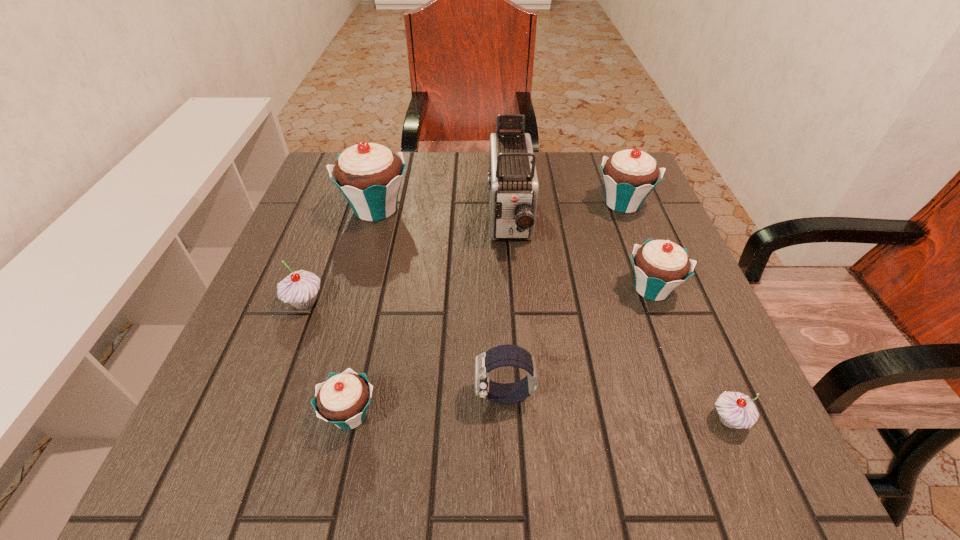
Select which object appears as the third closest to the left gray cupcake. Please provide its 2D coordinates. Your answer should be formatted as a tuple, i.e. [(x, y)], where the tuple contains the x and y coordinates of a point satisfying the conditions above.

[(503, 355)]

Select which cupcake appears as the second closest to the dark watch. Please provide its 2D coordinates. Your answer should be formatted as a tuple, i.e. [(x, y)], where the tuple contains the x and y coordinates of a point satisfying the conditions above.

[(660, 266)]

Locate which cupcake ranks fifth in proximity to the smallest teal cupcake. Please provide its 2D coordinates. Your answer should be formatted as a tuple, i.e. [(x, y)], where the tuple contains the x and y coordinates of a point satisfying the conditions above.

[(629, 176)]

Identify which teal cupcake is located as the fourth nearest to the bigger gray cupcake. Please provide its 2D coordinates. Your answer should be formatted as a tuple, i.e. [(x, y)], where the tuple contains the x and y coordinates of a point satisfying the conditions above.

[(629, 176)]

Locate an element on the screen. The width and height of the screenshot is (960, 540). teal cupcake that is the fourth closest to the farther gray cupcake is located at coordinates (629, 176).

Where is `free location that satisfies the following two spatial constraints: 1. on the back side of the nearer gray cupcake; 2. on the face of the dark watch`? free location that satisfies the following two spatial constraints: 1. on the back side of the nearer gray cupcake; 2. on the face of the dark watch is located at coordinates (719, 396).